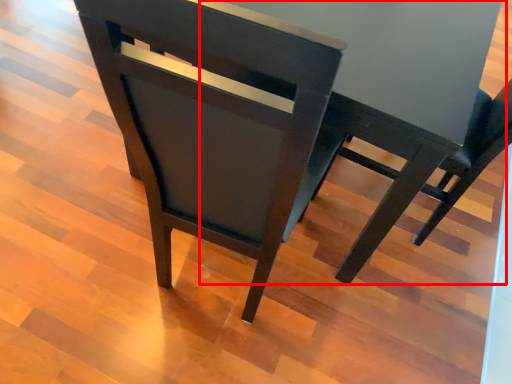
Question: In this image, where is round table (annotated by the red box) located relative to chair?

Choices:
 (A) left
 (B) right

Answer: (B)